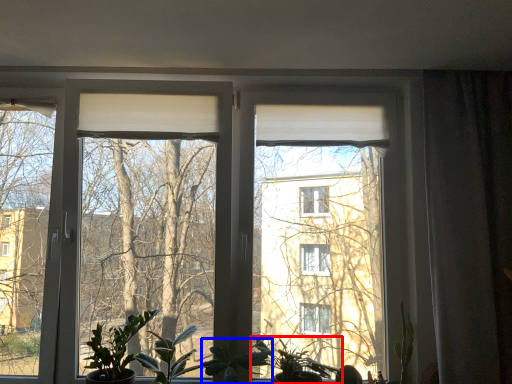
Question: Which point is closer to the camera, houseplant (highlighted by a red box) or plant (highlighted by a blue box)?

Choices:
 (A) houseplant
 (B) plant

Answer: (B)